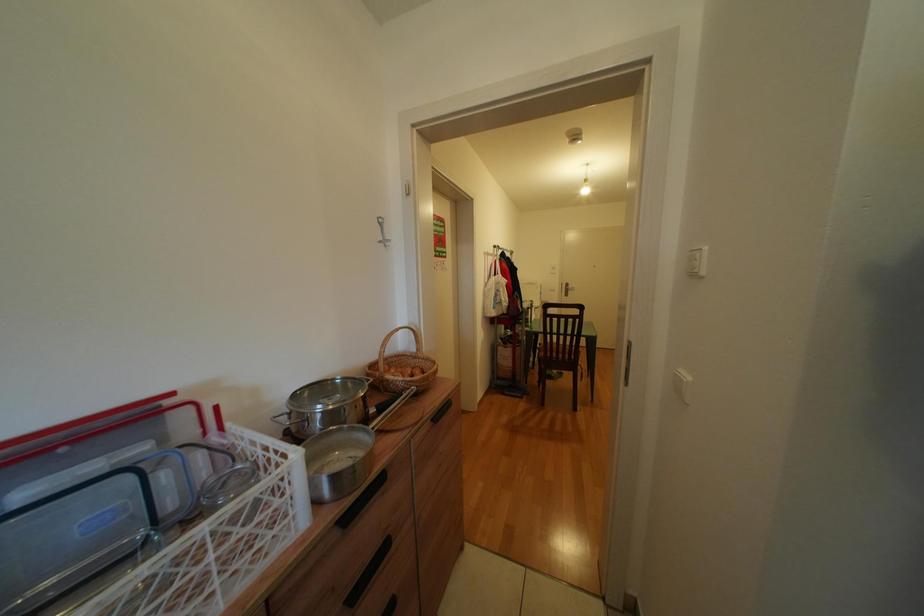
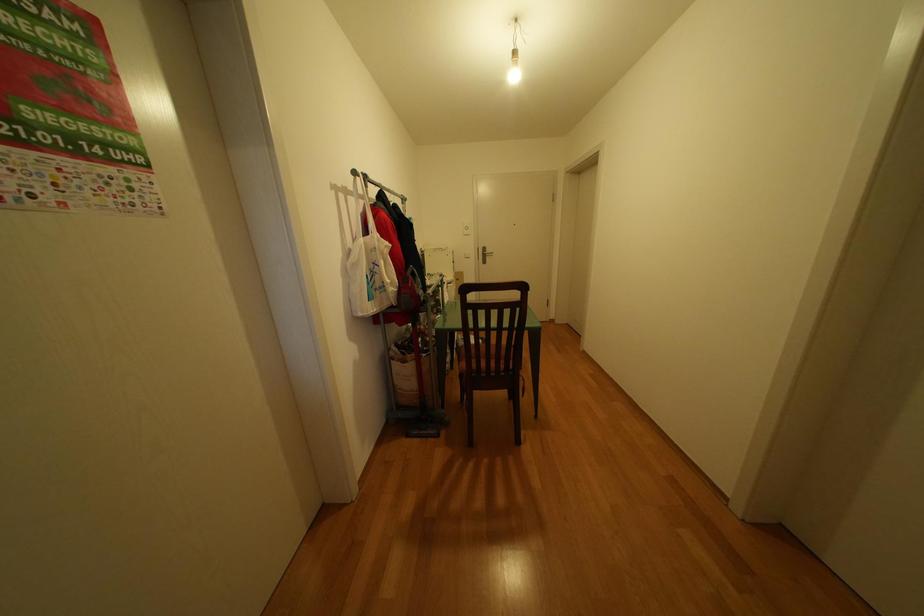
Question: Which direction would the cameraman need to move to produce the second image? Reply with the corresponding letter.

Choices:
 (A) Left
 (B) Right
 (C) Forward
 (D) Backward

Answer: (C)